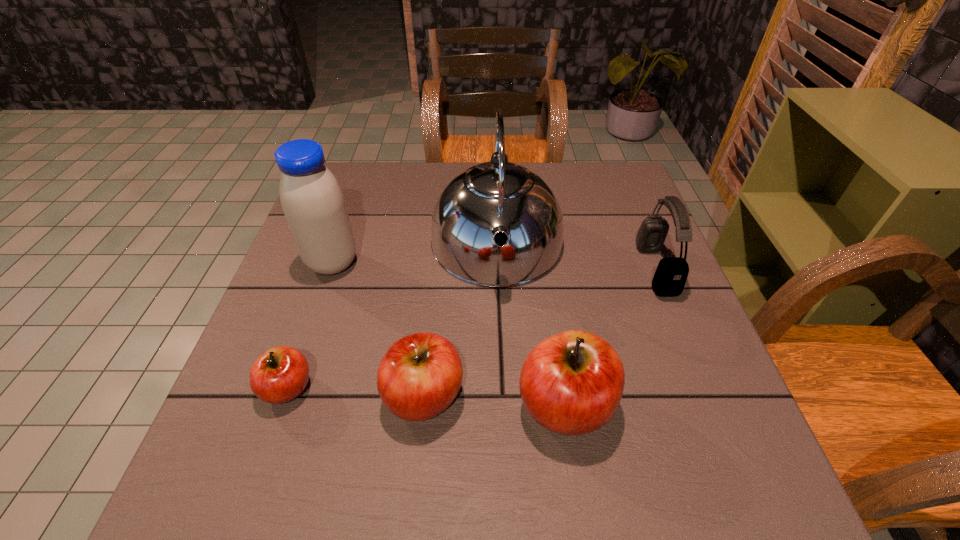
You are a GUI agent. You are given a task and a screenshot of the screen. Output one action in this format:
    pyautogui.click(x=<x>, y=<y>)
    Task: Click on the free space between the rightmost apple and the soya milk
    
    Given the screenshot: What is the action you would take?
    [x=448, y=334]

Where is `unoccupied position between the kettle and the second apple from right to left`? The width and height of the screenshot is (960, 540). unoccupied position between the kettle and the second apple from right to left is located at coordinates (461, 321).

You are a GUI agent. You are given a task and a screenshot of the screen. Output one action in this format:
    pyautogui.click(x=<x>, y=<y>)
    Task: Click on the free spot between the soya milk and the second shortest object
    The width and height of the screenshot is (960, 540).
    Given the screenshot: What is the action you would take?
    pyautogui.click(x=378, y=330)

Where is `free spot between the second tallest apple and the headset`? The width and height of the screenshot is (960, 540). free spot between the second tallest apple and the headset is located at coordinates (540, 333).

The image size is (960, 540). What are the coordinates of `empty space that is in between the rightmost apple and the soya milk` in the screenshot? It's located at (448, 334).

Identify the location of object that is the fifth closest to the soya milk. This screenshot has height=540, width=960. (671, 274).

Identify which object is located as the third nearest to the rightmost object. Please provide its 2D coordinates. Your answer should be formatted as a tuple, i.e. [(x, y)], where the tuple contains the x and y coordinates of a point satisfying the conditions above.

[(419, 376)]

Identify the location of apple that is the nearest to the shortest object. (419, 376).

At what (x,y) coordinates should I click in order to perform the action: click on the second closest apple to the kettle. Please return your answer as a coordinate pair (x, y). Looking at the image, I should click on point(571,383).

I want to click on vacant area in the image that satisfies the following two spatial constraints: 1. on the headband of the headset; 2. on the front side of the shortest apple, so click(x=704, y=388).